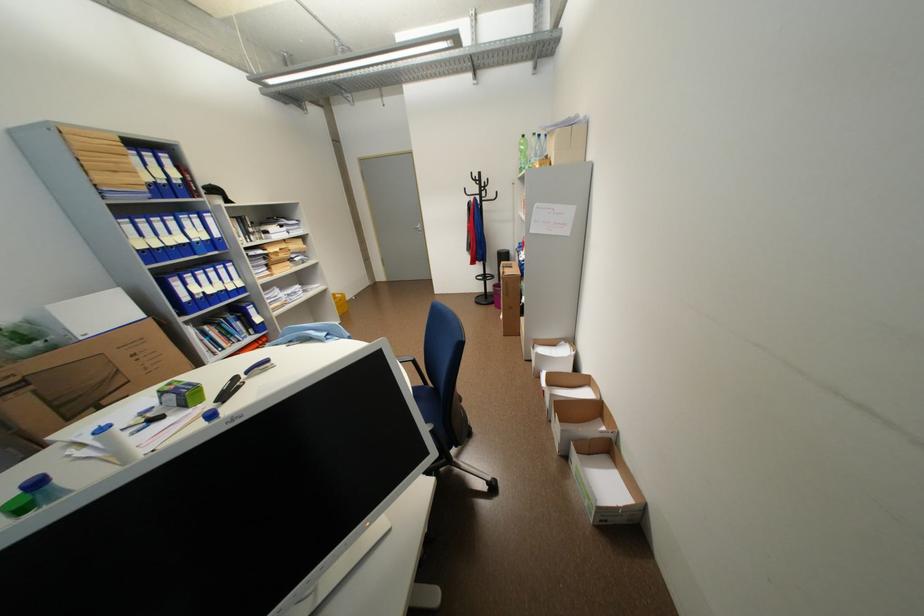
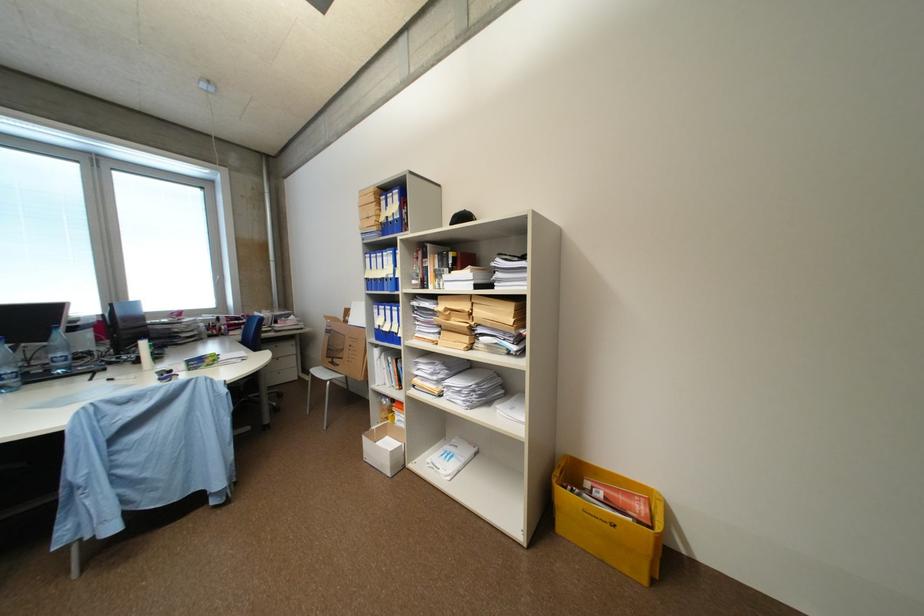
Locate, in the second image, the point that corresponds to (67,408) in the first image.

(336, 350)